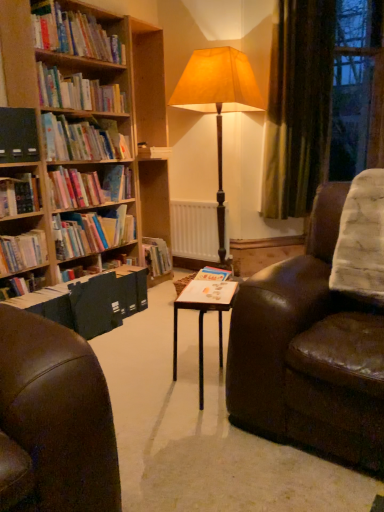
Where is `vacant point above white wooden table at center (from a real-world perspective)`? vacant point above white wooden table at center (from a real-world perspective) is located at coordinates (200, 294).